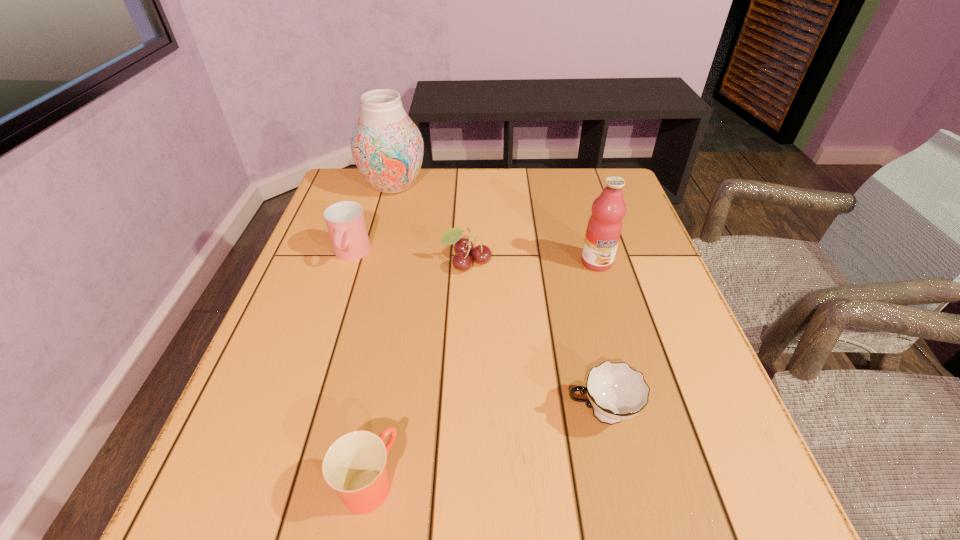
This screenshot has width=960, height=540. I want to click on cup object that ranks as the second closest to the tallest object, so click(615, 391).

Find the location of `cup that is the closest to the second cup from left to right`. cup that is the closest to the second cup from left to right is located at coordinates (615, 391).

At what (x,y) coordinates should I click in order to perform the action: click on vacant position in the image that satisfies the following two spatial constraints: 1. on the front side of the farthest object; 2. on the side of the fifth farthest object with the handle. Please return your answer as a coordinate pair (x, y). This screenshot has width=960, height=540. Looking at the image, I should click on pyautogui.click(x=332, y=413).

Where is `vacant space that satisfies the following two spatial constraints: 1. on the side of the farthest cup with the handle; 2. on the side of the second nearest object with the handle`? This screenshot has width=960, height=540. vacant space that satisfies the following two spatial constraints: 1. on the side of the farthest cup with the handle; 2. on the side of the second nearest object with the handle is located at coordinates (299, 413).

Image resolution: width=960 pixels, height=540 pixels. I want to click on free space that satisfies the following two spatial constraints: 1. on the leaves of the fourth object from left to right; 2. on the side of the second nearest cup with the handle, so click(461, 413).

The width and height of the screenshot is (960, 540). I want to click on vacant area in the image that satisfies the following two spatial constraints: 1. on the side of the fifth farthest object with the handle; 2. on the side of the farthest cup with the handle, so click(x=566, y=255).

I want to click on vacant space that satisfies the following two spatial constraints: 1. on the side of the nearest cup with the handle; 2. on the right side of the farthest cup, so click(x=276, y=482).

Locate an element on the screen. free space that satisfies the following two spatial constraints: 1. on the side of the leftmost cup with the handle; 2. on the left side of the nearest cup is located at coordinates (276, 482).